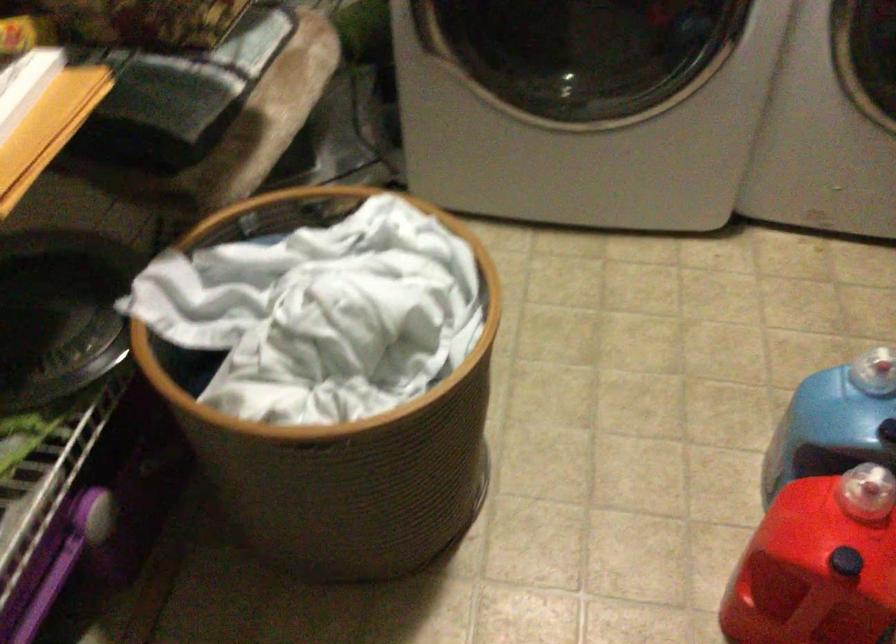
Find where to twist the red container cap. Please return your answer as a coordinate pair (x, y).

(866, 491)